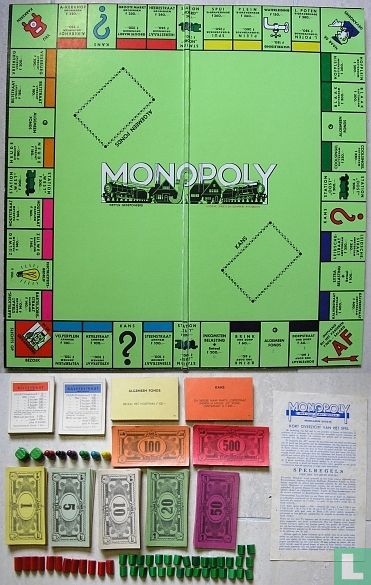
Image resolution: width=371 pixels, height=585 pixels. Identify the location of piles of game money. (27, 502), (71, 502), (123, 504), (169, 505), (209, 508), (233, 441), (161, 442).